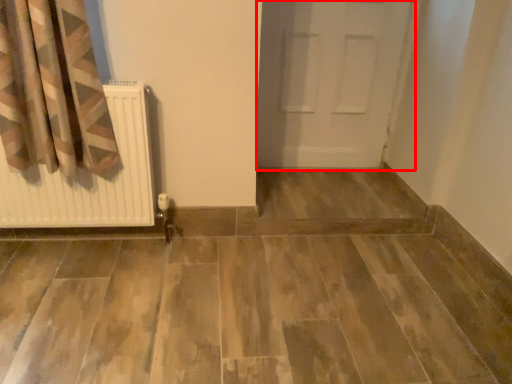
Question: Observing the image, what is the correct spatial positioning of door (annotated by the red box) in reference to radiator?

Choices:
 (A) left
 (B) right

Answer: (B)